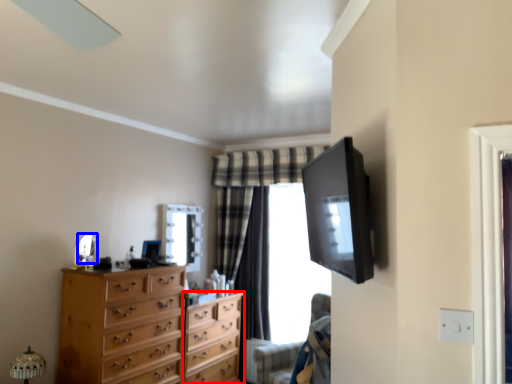
Question: Which object appears farthest to the camera in this image, chest of drawers (highlighted by a red box) or mirror (highlighted by a blue box)?

Choices:
 (A) chest of drawers
 (B) mirror

Answer: (A)